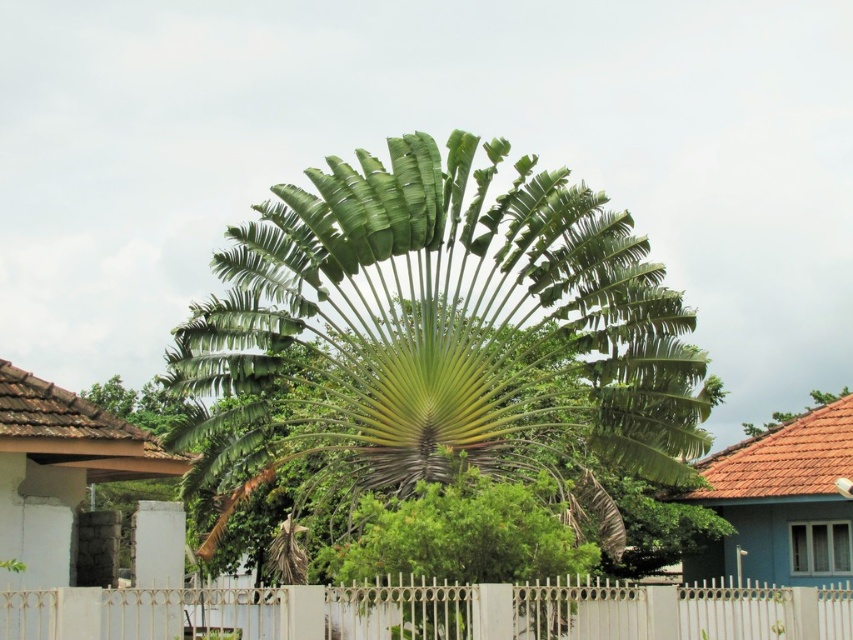
Is point (664, 416) behind point (309, 612)?

Yes, it is behind point (309, 612).

Can you confirm if green leafy palm at center is bigger than white metal fence at center?

Yes.

The height and width of the screenshot is (640, 853). In order to click on green leafy palm at center in this screenshot , I will do `click(439, 333)`.